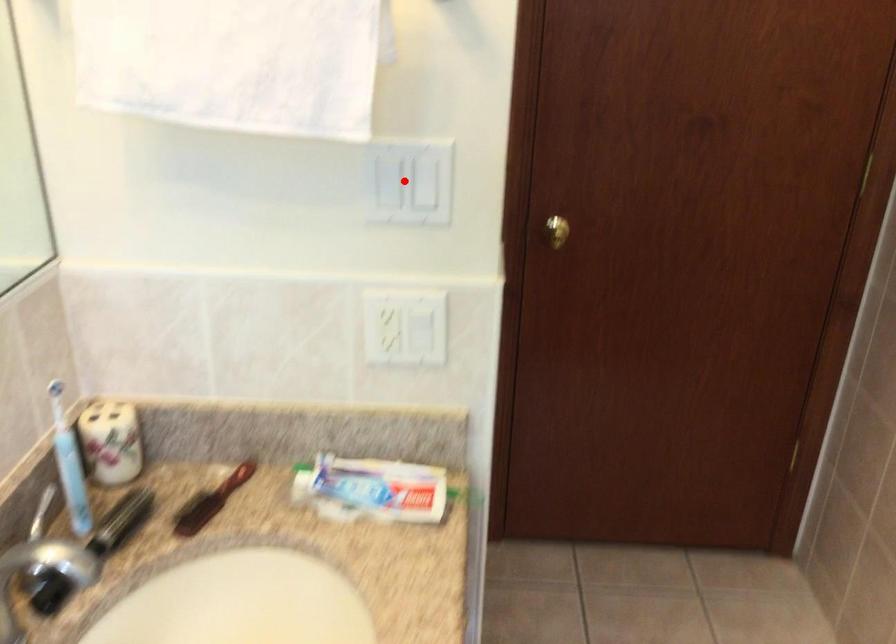
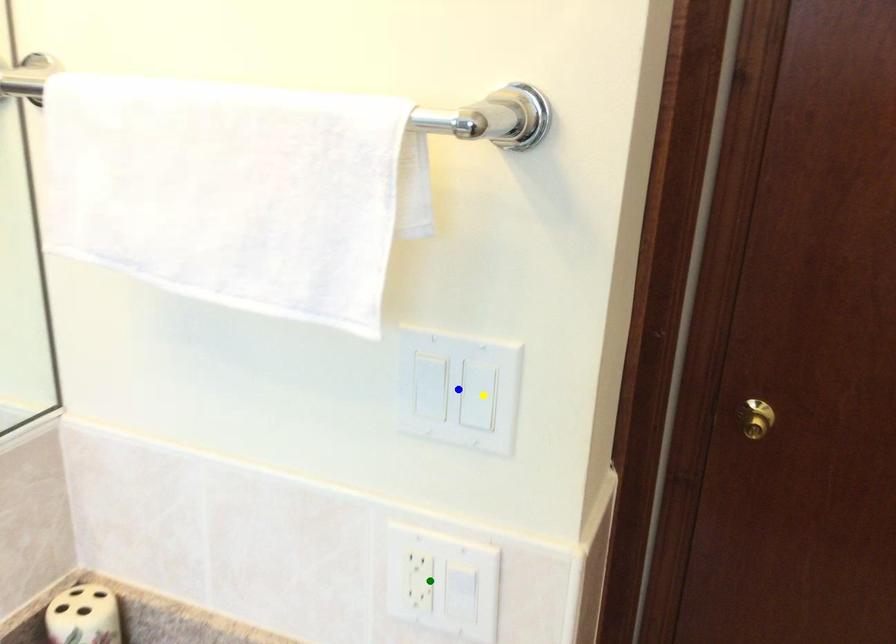
Question: I am providing you with two images of the same scene from different viewpoints. A red point is marked on the first image. You are given multiple points on the second image. Which spot in image 2 lines up with the point in image 1?

Choices:
 (A) green point
 (B) blue point
 (C) yellow point

Answer: (B)